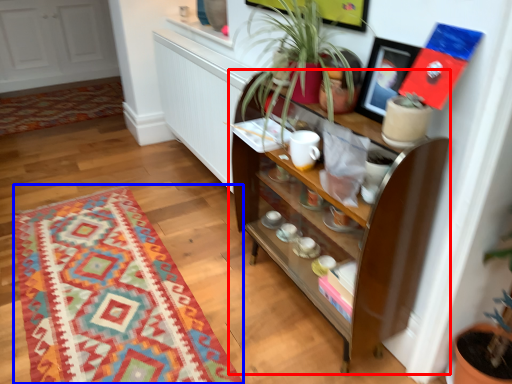
Question: Which object appears closest to the camera in this image, shelf (highlighted by a red box) or mat (highlighted by a blue box)?

Choices:
 (A) shelf
 (B) mat

Answer: (A)